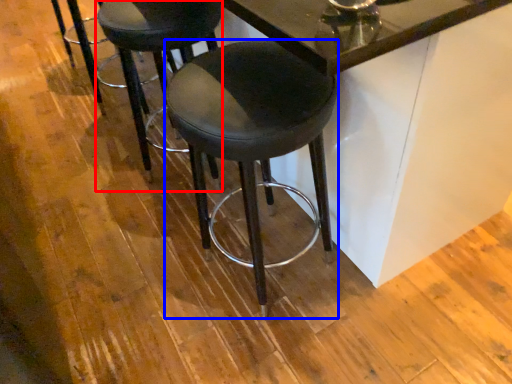
Question: Which of the following is the farthest to the observer, stool (highlighted by a red box) or stool (highlighted by a blue box)?

Choices:
 (A) stool
 (B) stool

Answer: (A)